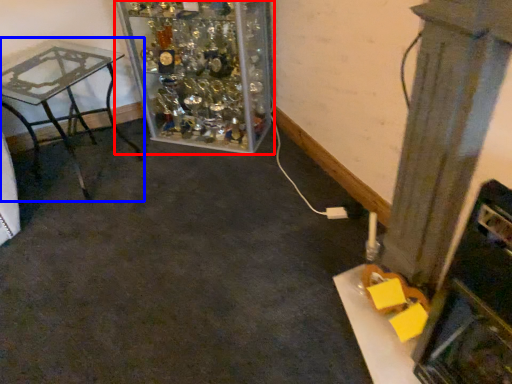
Question: Which of the following is the closest to the observer, furniture (highlighted by a red box) or table (highlighted by a blue box)?

Choices:
 (A) furniture
 (B) table

Answer: (B)